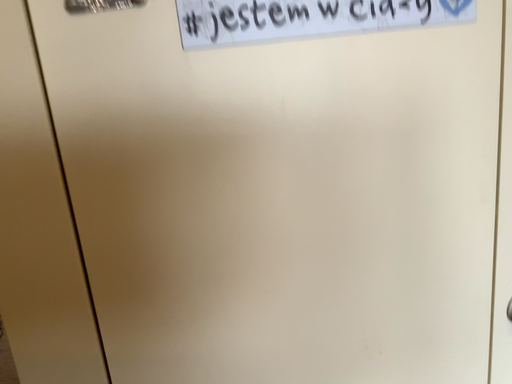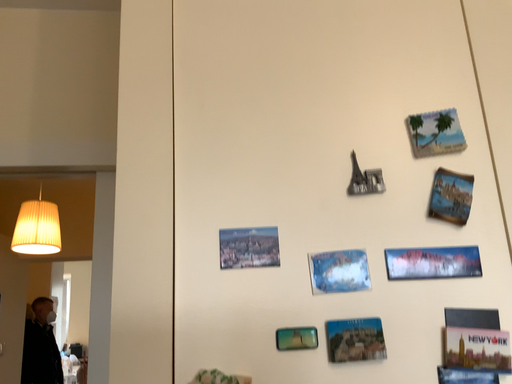
Question: How did the camera likely rotate when shooting the video?

Choices:
 (A) rotated left
 (B) rotated right

Answer: (A)